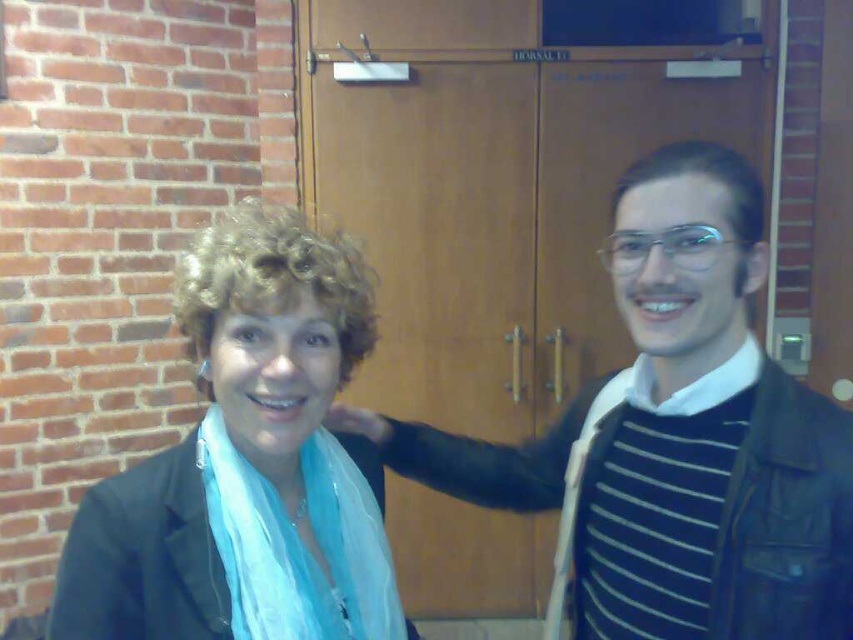
Question: Which object is the farthest from the light blue silky scarf at center?

Choices:
 (A) striped knit sweater at center
 (B) matte black jacket at left

Answer: (A)

Question: Which object is farther from the camera taking this photo?

Choices:
 (A) striped knit sweater at center
 (B) light blue silky scarf at center
 (C) matte black jacket at left

Answer: (A)

Question: Can you confirm if striped knit sweater at center is positioned to the right of matte black jacket at left?

Choices:
 (A) yes
 (B) no

Answer: (A)

Question: Does matte black jacket at left have a greater width compared to light blue silky scarf at center?

Choices:
 (A) no
 (B) yes

Answer: (B)

Question: Which point is closer to the camera?

Choices:
 (A) (80, 508)
 (B) (360, 500)

Answer: (A)

Question: Does striped knit sweater at center appear under matte black jacket at left?

Choices:
 (A) yes
 (B) no

Answer: (A)